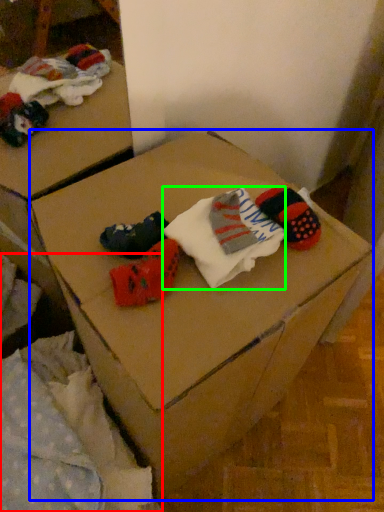
Question: Based on their relative distances, which object is farther from bedding (highlighted by a red box)? Choose from furniture (highlighted by a blue box) and sock (highlighted by a green box).

Choices:
 (A) furniture
 (B) sock

Answer: (B)